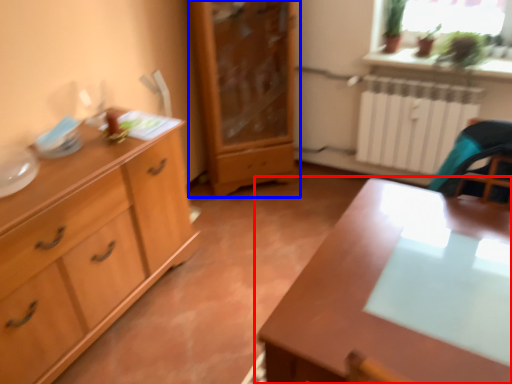
Question: Which point is closer to the camera, table (highlighted by a red box) or chest of drawers (highlighted by a blue box)?

Choices:
 (A) table
 (B) chest of drawers

Answer: (A)